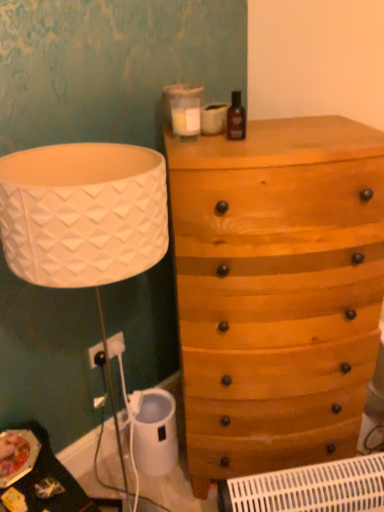
What is the approximate height of white plastic electric outlet at lower left?

white plastic electric outlet at lower left is 4.21 inches in height.

I want to click on white plastic radiator at lower center, so click(x=309, y=488).

The image size is (384, 512). What do you see at coordinates (276, 291) in the screenshot?
I see `wooden chest of drawers at upper right` at bounding box center [276, 291].

Where is `white plastic electric outlet at lower left`? This screenshot has width=384, height=512. white plastic electric outlet at lower left is located at coordinates (116, 345).

Locate an element on the screen. Image resolution: width=384 pixels, height=512 pixels. air conditioning in front of the white plastic electric outlet at lower left is located at coordinates (309, 488).

Based on their positions, is white plastic electric outlet at lower left located to the left or right of white plastic radiator at lower center?

white plastic electric outlet at lower left is positioned on white plastic radiator at lower center's left side.

From a real-world perspective, between white plastic electric outlet at lower left and white plastic radiator at lower center, who is vertically higher?

In real-world perspective, white plastic electric outlet at lower left is above.

Which is correct: white plastic electric outlet at lower left is inside white plastic radiator at lower center, or outside of it?

white plastic electric outlet at lower left is not enclosed by white plastic radiator at lower center.

In the image, there is a white plastic radiator at lower center. Identify the location of bottle above it (from the image's perspective). The width and height of the screenshot is (384, 512). (236, 118).

From the image's perspective, is brown glass bottle at upper center below white plastic radiator at lower center?

No, from the image's perspective, brown glass bottle at upper center is not below white plastic radiator at lower center.

From a real-world perspective, between brown glass bottle at upper center and white plastic radiator at lower center, who is vertically higher?

From a 3D spatial view, brown glass bottle at upper center is above.

Is wooden chest of drawers at upper right located outside white plastic electric outlet at lower left?

Absolutely, wooden chest of drawers at upper right is external to white plastic electric outlet at lower left.

From a real-world perspective, which object rests below the other?

white plastic electric outlet at lower left is physically lower.

Between point (314, 121) and point (108, 352), which one is positioned behind?

The point (108, 352) is farther.

From the picture: From the image's perspective, who appears lower, white plastic electric outlet at lower left or brown glass bottle at upper center?

white plastic electric outlet at lower left.

Based on the photo, which object is wider, white plastic electric outlet at lower left or brown glass bottle at upper center?

Wider between the two is brown glass bottle at upper center.

Considering the relative sizes of white plastic electric outlet at lower left and brown glass bottle at upper center in the image provided, is white plastic electric outlet at lower left smaller than brown glass bottle at upper center?

No.

In the scene shown: Is white plastic electric outlet at lower left next to brown glass bottle at upper center?

No.

Looking at this image, does white plastic radiator at lower center lie in front of brown glass bottle at upper center?

Yes, it is in front of brown glass bottle at upper center.

In the scene shown: How different are the orientations of white plastic radiator at lower center and brown glass bottle at upper center in degrees?

There is a 1.65-degree angle between the facing directions of white plastic radiator at lower center and brown glass bottle at upper center.

Can you confirm if white plastic radiator at lower center is positioned to the right of brown glass bottle at upper center?

Yes, white plastic radiator at lower center is to the right of brown glass bottle at upper center.

Is white plastic radiator at lower center located outside brown glass bottle at upper center?

Absolutely, white plastic radiator at lower center is external to brown glass bottle at upper center.

Looking at the image, does wooden chest of drawers at upper right seem bigger or smaller compared to white plastic radiator at lower center?

Clearly, wooden chest of drawers at upper right is larger in size than white plastic radiator at lower center.

How many degrees apart are the facing directions of wooden chest of drawers at upper right and white plastic radiator at lower center?

2.87 degrees separate the facing orientations of wooden chest of drawers at upper right and white plastic radiator at lower center.

Can you see wooden chest of drawers at upper right touching white plastic radiator at lower center?

wooden chest of drawers at upper right is not next to white plastic radiator at lower center, and they're not touching.

Which is farther, (x=223, y=425) or (x=239, y=139)?

The point (x=223, y=425) is farther.

Where is `chest of drawers on the right of brown glass bottle at upper center`? chest of drawers on the right of brown glass bottle at upper center is located at coordinates (276, 291).

Considering the sizes of objects wooden chest of drawers at upper right and brown glass bottle at upper center in the image provided, who is taller, wooden chest of drawers at upper right or brown glass bottle at upper center?

wooden chest of drawers at upper right.

Is wooden chest of drawers at upper right facing away from brown glass bottle at upper center?

No, wooden chest of drawers at upper right's orientation is not away from brown glass bottle at upper center.

Identify the location of electric outlet on the left of white plastic radiator at lower center. (116, 345).

The image size is (384, 512). I want to click on bottle behind the white plastic radiator at lower center, so click(236, 118).

From the image, which object appears to be nearer to white plastic radiator at lower center, white plastic electric outlet at lower left or brown glass bottle at upper center?

white plastic electric outlet at lower left.

Estimate the real-world distances between objects in this image. Which object is closer to wooden chest of drawers at upper right, white plastic electric outlet at lower left or brown glass bottle at upper center?

brown glass bottle at upper center is closer to wooden chest of drawers at upper right.

Considering their positions, is white plastic electric outlet at lower left positioned further to wooden chest of drawers at upper right than white plastic radiator at lower center?

Among the two, white plastic electric outlet at lower left is located further to wooden chest of drawers at upper right.

Based on their spatial positions, is wooden chest of drawers at upper right or white plastic radiator at lower center closer to brown glass bottle at upper center?

Among the two, wooden chest of drawers at upper right is located nearer to brown glass bottle at upper center.

Based on the photo, considering their positions, is wooden chest of drawers at upper right positioned closer to white plastic radiator at lower center than white plastic electric outlet at lower left?

Result: wooden chest of drawers at upper right lies closer to white plastic radiator at lower center than the other object.

Estimate the real-world distances between objects in this image. Which object is closer to white plastic electric outlet at lower left, brown glass bottle at upper center or white plastic radiator at lower center?

white plastic radiator at lower center is positioned closer to the anchor white plastic electric outlet at lower left.

In the scene shown: Which object lies nearer to the anchor point wooden chest of drawers at upper right, brown glass bottle at upper center or white plastic electric outlet at lower left?

brown glass bottle at upper center lies closer to wooden chest of drawers at upper right than the other object.

Looking at this image, looking at the image, which one is located closer to white plastic radiator at lower center, brown glass bottle at upper center or white plastic electric outlet at lower left?

white plastic electric outlet at lower left lies closer to white plastic radiator at lower center than the other object.

Where is `electric outlet between brown glass bottle at upper center and white plastic radiator at lower center in the up-down direction`? Image resolution: width=384 pixels, height=512 pixels. electric outlet between brown glass bottle at upper center and white plastic radiator at lower center in the up-down direction is located at coordinates (116, 345).

Locate an element on the screen. This screenshot has height=512, width=384. the chest of drawers situated between white plastic electric outlet at lower left and white plastic radiator at lower center from left to right is located at coordinates (276, 291).

This screenshot has width=384, height=512. I want to click on chest of drawers between brown glass bottle at upper center and white plastic electric outlet at lower left from top to bottom, so click(x=276, y=291).

This screenshot has height=512, width=384. I want to click on chest of drawers between brown glass bottle at upper center and white plastic radiator at lower center from top to bottom, so click(276, 291).